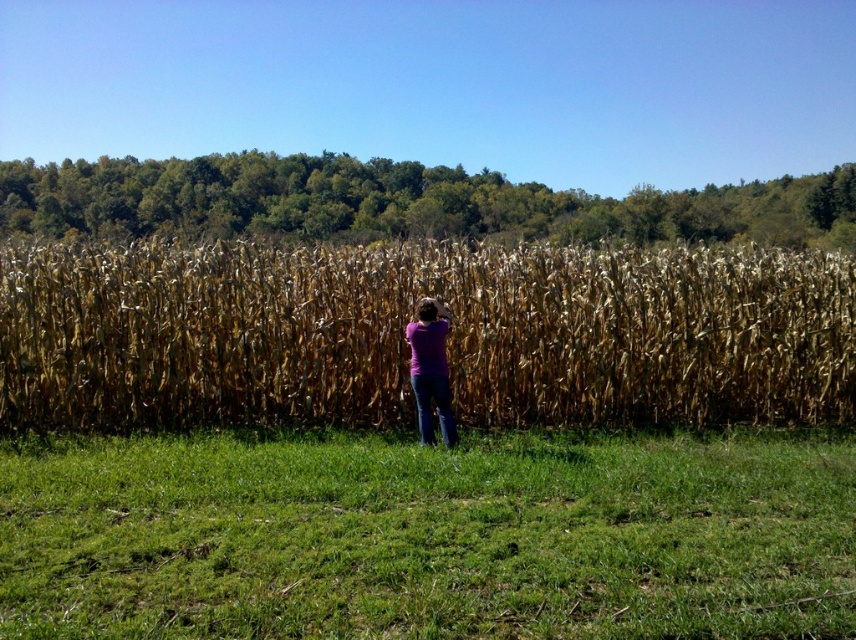
Is dry stalks of corn at center further to the viewer compared to purple matte shirt at center?

That is True.

Where is `dry stalks of corn at center`? Image resolution: width=856 pixels, height=640 pixels. dry stalks of corn at center is located at coordinates (403, 339).

Is green grass at lower center positioned in front of purple matte shirt at center?

That is True.

What do you see at coordinates (428, 536) in the screenshot? The height and width of the screenshot is (640, 856). I see `green grass at lower center` at bounding box center [428, 536].

Find the location of a particular element. The image size is (856, 640). green grass at lower center is located at coordinates (428, 536).

What do you see at coordinates (428, 536) in the screenshot? The image size is (856, 640). I see `green grass at lower center` at bounding box center [428, 536].

Does point (1, 477) come in front of point (33, 384)?

Yes.

Which is in front, point (241, 536) or point (513, 388)?

Point (241, 536)

The image size is (856, 640). Identify the location of green grass at lower center. (428, 536).